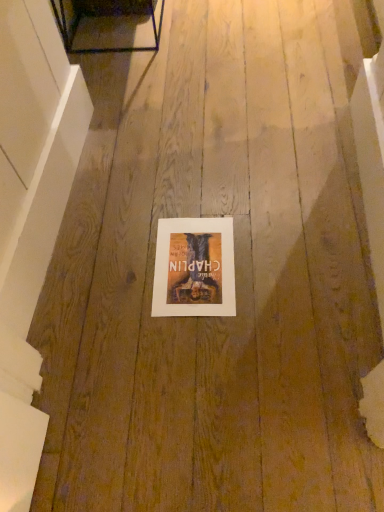
Question: Which is correct: white smooth wall at left is inside matte paper poster at center, or outside of it?

Choices:
 (A) inside
 (B) outside

Answer: (B)

Question: Is white smooth wall at left bigger or smaller than matte paper poster at center?

Choices:
 (A) big
 (B) small

Answer: (A)

Question: In the image, is white smooth wall at left on the left side or the right side of matte paper poster at center?

Choices:
 (A) left
 (B) right

Answer: (A)

Question: Does point (188, 220) appear closer or farther from the camera than point (39, 39)?

Choices:
 (A) farther
 (B) closer

Answer: (A)

Question: Choose the correct answer: Is matte paper poster at center inside white smooth wall at left or outside it?

Choices:
 (A) outside
 (B) inside

Answer: (A)

Question: From a real-world perspective, relative to white smooth wall at left, is matte paper poster at center vertically above or below?

Choices:
 (A) below
 (B) above

Answer: (A)

Question: Would you say matte paper poster at center is to the left or to the right of white smooth wall at left in the picture?

Choices:
 (A) left
 (B) right

Answer: (B)